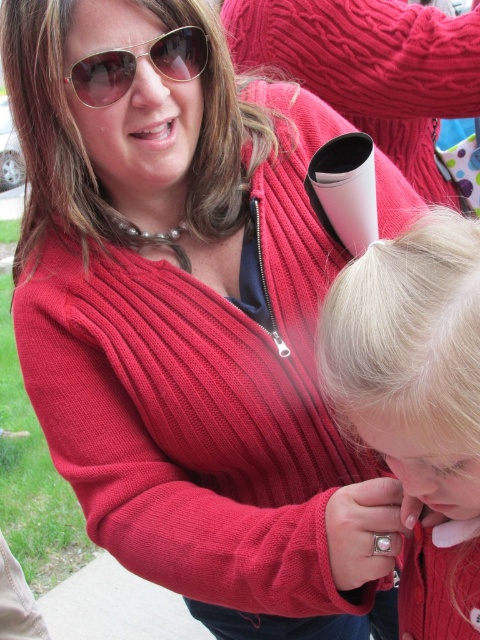
Question: Which of the following is the farthest from the observer?

Choices:
 (A) (160, 64)
 (B) (211, 92)
 (C) (418, 620)

Answer: (B)

Question: Which point is closer to the camera?

Choices:
 (A) blonde hair at upper center
 (B) metallic reflective sunglasses at upper left
 (C) blonde hair at center

Answer: (C)

Question: Does blonde hair at upper center come behind metallic reflective sunglasses at upper left?

Choices:
 (A) no
 (B) yes

Answer: (A)

Question: Considering the relative positions of blonde hair at center and metallic reflective sunglasses at upper left in the image provided, where is blonde hair at center located with respect to metallic reflective sunglasses at upper left?

Choices:
 (A) below
 (B) above

Answer: (A)

Question: Observing the image, what is the correct spatial positioning of blonde hair at upper center in reference to metallic reflective sunglasses at upper left?

Choices:
 (A) left
 (B) right

Answer: (A)

Question: Which point is farther to the camera?

Choices:
 (A) metallic reflective sunglasses at upper left
 (B) blonde hair at upper center

Answer: (A)